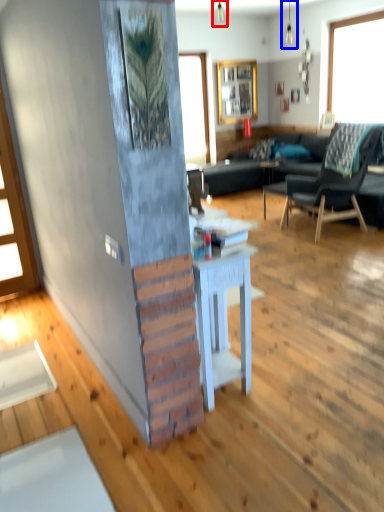
Question: Among these objects, which one is nearest to the camera, lamp (highlighted by a red box) or lamp (highlighted by a blue box)?

Choices:
 (A) lamp
 (B) lamp

Answer: (B)